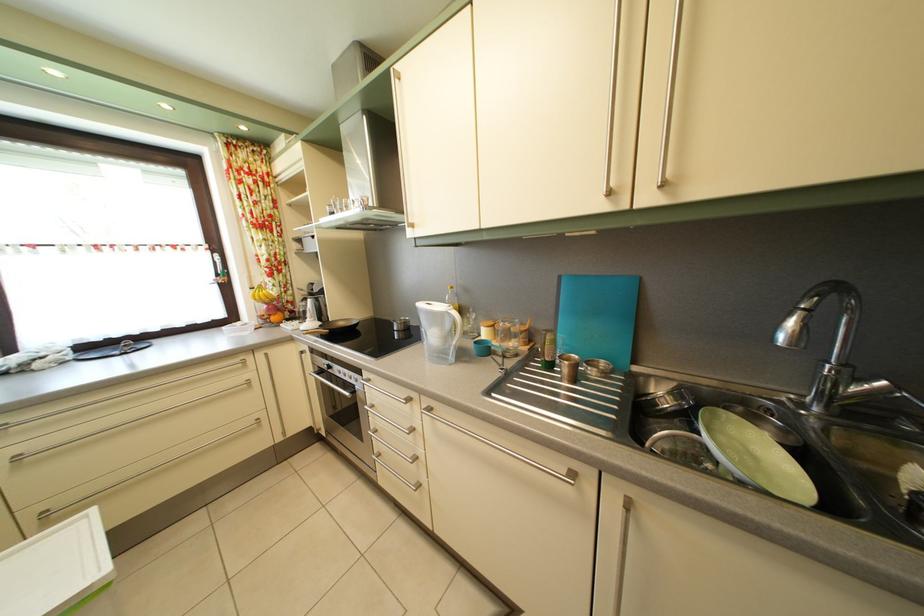
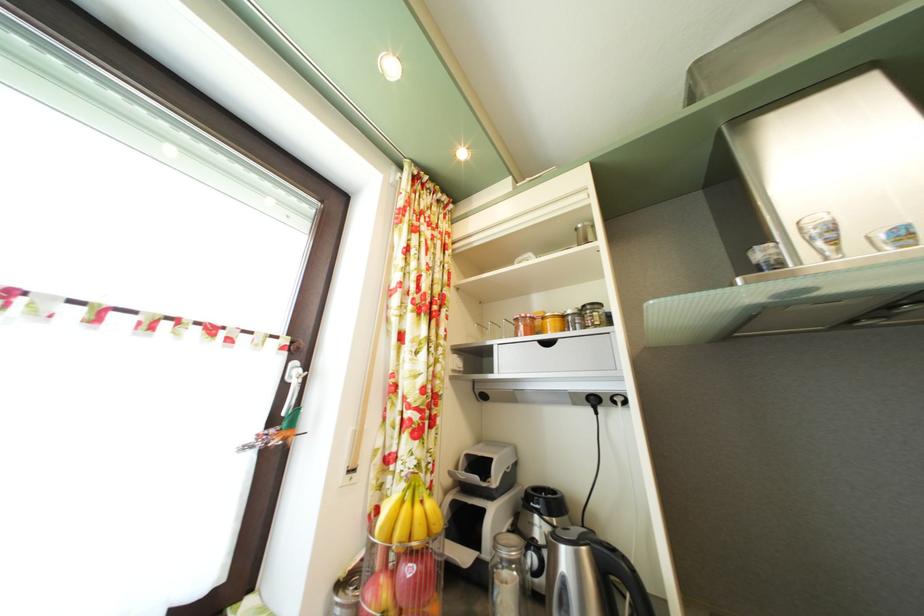
The point at [225,262] is marked in the first image. Where is the corresponding point in the second image?

(304, 371)